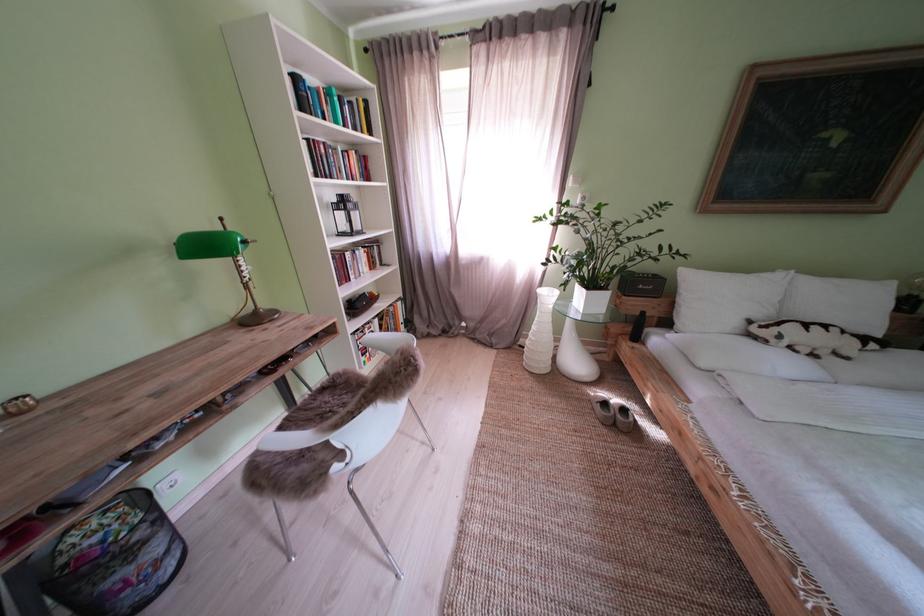
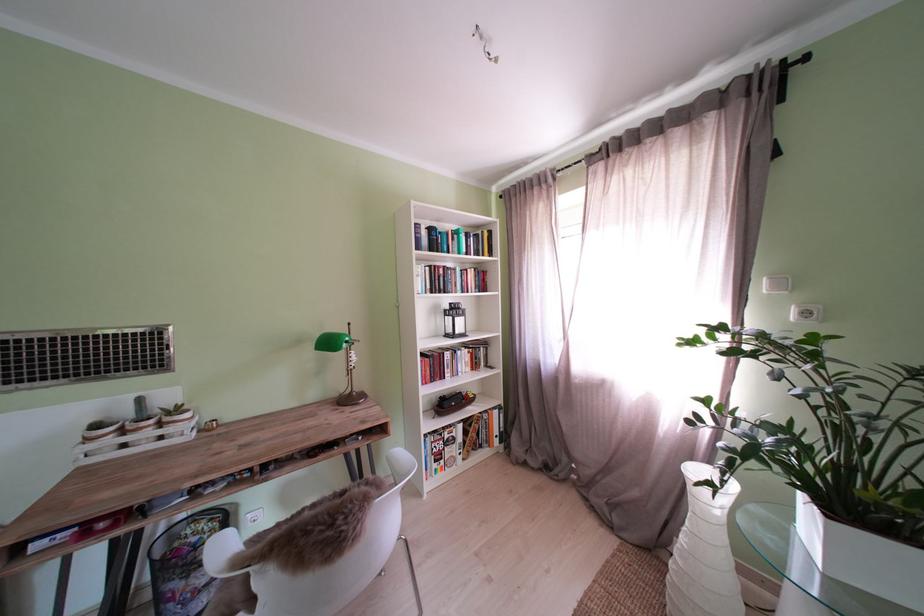
The point at (104, 528) is marked in the first image. Where is the corresponding point in the second image?

(213, 530)